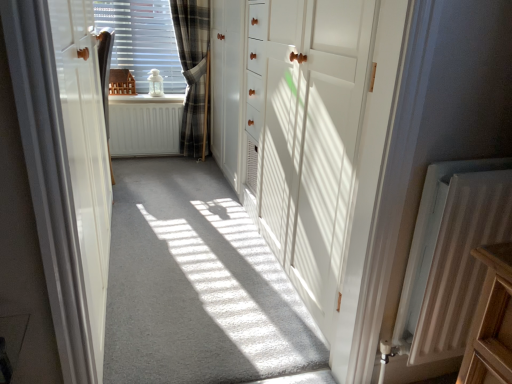
Describe the element at coordinates (311, 138) in the screenshot. The height and width of the screenshot is (384, 512). I see `white wood door at center, the first door viewed from the right` at that location.

The image size is (512, 384). Describe the element at coordinates (449, 258) in the screenshot. I see `white textured radiator at lower right, the first radiator viewed from the right` at that location.

Describe the element at coordinates (143, 40) in the screenshot. I see `translucent plastic window at center` at that location.

This screenshot has height=384, width=512. In order to click on plaid fabric curtain at center, which is the 1th curtain in back-to-front order in this screenshot , I will do `click(194, 73)`.

This screenshot has height=384, width=512. I want to click on white matte radiator at center, the 2th radiator when ordered from front to back, so click(x=144, y=126).

Identify the location of white glossy door at left, the 1th door from the left. (85, 153).

In order to face white glossy door at left, the 1th door from the left, should I rotate leftwards or rightwards?

You should look left and rotate roughly 23.320 degrees.

Identify the location of white wood door at center, the 2th door from the left. (311, 138).

Are white wood door at center, the 2th door from the left, and white glossy door at left, positioned as the second door in right-to-left order, located far from each other?

No, white wood door at center, the 2th door from the left, is not far from white glossy door at left, positioned as the second door in right-to-left order.

From the image's perspective, which is below, white wood door at center, the first door viewed from the right, or white glossy door at left, the 1th door from the left?

white glossy door at left, the 1th door from the left, from the image's perspective.

How much distance is there between white wood door at center, the 2th door from the left, and white glossy door at left, positioned as the second door in right-to-left order?

white wood door at center, the 2th door from the left, and white glossy door at left, positioned as the second door in right-to-left order, are 33.06 inches apart from each other.

Is white glossy door at left, the 1th door from the left, surrounded by white wood door at center, the first door viewed from the right?

No.

Considering the sizes of objects white matte radiator at center, the first radiator viewed from the top, and translucent plastic window at center in the image provided, who is thinner, white matte radiator at center, the first radiator viewed from the top, or translucent plastic window at center?

With smaller width is white matte radiator at center, the first radiator viewed from the top.

From a real-world perspective, which object rests below the other?

white matte radiator at center, the 1th radiator viewed from the left, from a real-world perspective.

Which of these two, white matte radiator at center, which is the first radiator in back-to-front order, or translucent plastic window at center, is smaller?

white matte radiator at center, which is the first radiator in back-to-front order, is smaller.

The image size is (512, 384). I want to click on the 1st radiator below when counting from the translucent plastic window at center (from the image's perspective), so click(x=144, y=126).

Is translucent plastic window at center oriented towards white carpet at center?

Yes.

From a real-world perspective, who is located higher, translucent plastic window at center or white carpet at center?

translucent plastic window at center.

From the picture: Is translucent plastic window at center located outside white carpet at center?

Absolutely, translucent plastic window at center is external to white carpet at center.

Based on the photo, which object is wider, translucent plastic window at center or white carpet at center?

Wider between the two is white carpet at center.

Is satin brown curtain at center, acting as the 1th curtain starting from the front, taller or shorter than plaid fabric curtain at center, which appears as the 2th curtain when viewed from the front?

satin brown curtain at center, acting as the 1th curtain starting from the front, is shorter than plaid fabric curtain at center, which appears as the 2th curtain when viewed from the front.

Based on their sizes in the image, would you say satin brown curtain at center, positioned as the 1th curtain in left-to-right order, is bigger or smaller than plaid fabric curtain at center, which is the 2th curtain from left to right?

satin brown curtain at center, positioned as the 1th curtain in left-to-right order, is smaller than plaid fabric curtain at center, which is the 2th curtain from left to right.

Is satin brown curtain at center, positioned as the 1th curtain in left-to-right order, positioned before plaid fabric curtain at center, which is the 1th curtain in back-to-front order?

Yes, satin brown curtain at center, positioned as the 1th curtain in left-to-right order, is in front of plaid fabric curtain at center, which is the 1th curtain in back-to-front order.

Which object is wider, satin brown curtain at center, acting as the 1th curtain starting from the front, or plaid fabric curtain at center, which is the 1th curtain in back-to-front order?

plaid fabric curtain at center, which is the 1th curtain in back-to-front order, is wider.

Based on the photo, in the image, is white matte radiator at center, the 2th radiator when ordered from front to back, on the left side or the right side of satin brown curtain at center, positioned as the 1th curtain in left-to-right order?

From the image, it's evident that white matte radiator at center, the 2th radiator when ordered from front to back, is to the right of satin brown curtain at center, positioned as the 1th curtain in left-to-right order.

From a real-world perspective, between white matte radiator at center, the 2th radiator in the right-to-left sequence, and satin brown curtain at center, acting as the 1th curtain starting from the front, who is vertically higher?

satin brown curtain at center, acting as the 1th curtain starting from the front, from a real-world perspective.

Does white matte radiator at center, the 1th radiator viewed from the left, have a larger size compared to satin brown curtain at center, the second curtain in the back-to-front sequence?

Incorrect, white matte radiator at center, the 1th radiator viewed from the left, is not larger than satin brown curtain at center, the second curtain in the back-to-front sequence.

Considering the relative sizes of white matte radiator at center, which ranks as the second radiator in bottom-to-top order, and satin brown curtain at center, acting as the 1th curtain starting from the front, in the image provided, is white matte radiator at center, which ranks as the second radiator in bottom-to-top order, thinner than satin brown curtain at center, acting as the 1th curtain starting from the front,?

Yes.

Considering the relative sizes of white carpet at center and white matte radiator at center, the 2th radiator when ordered from front to back, in the image provided, is white carpet at center thinner than white matte radiator at center, the 2th radiator when ordered from front to back,?

Incorrect, the width of white carpet at center is not less than that of white matte radiator at center, the 2th radiator when ordered from front to back.

Which is correct: white carpet at center is inside white matte radiator at center, which is the first radiator in back-to-front order, or outside of it?

white carpet at center is spatially situated outside white matte radiator at center, which is the first radiator in back-to-front order.

Which object is more forward, white carpet at center or white matte radiator at center, the 2th radiator when ordered from front to back?

Positioned in front is white carpet at center.

From a real-world perspective, who is located lower, white carpet at center or white matte radiator at center, which ranks as the second radiator in bottom-to-top order?

white carpet at center, from a real-world perspective.

Is point (192, 249) positioned behind point (100, 276)?

Yes, point (192, 249) is farther from viewer.

Between white carpet at center and white glossy door at left, the 1th door from the left, which one has larger size?

white glossy door at left, the 1th door from the left.

Is white carpet at center next to white glossy door at left, the 1th door from the left?

No, white carpet at center is not beside white glossy door at left, the 1th door from the left.

Does white carpet at center have a greater width compared to white glossy door at left, the 1th door from the left?

Correct, the width of white carpet at center exceeds that of white glossy door at left, the 1th door from the left.

Image resolution: width=512 pixels, height=384 pixels. What are the coordinates of `door in front of the white wood door at center, the 2th door from the left` in the screenshot? It's located at (85, 153).

Locate an element on the screen. This screenshot has height=384, width=512. window located above the white matte radiator at center, the 1th radiator viewed from the left (from the image's perspective) is located at coordinates (143, 40).

Based on their spatial positions, is plaid fabric curtain at center, which is the 2th curtain from left to right, or white glossy door at left, the 1th door from the left, closer to white carpet at center?

white glossy door at left, the 1th door from the left, is closer to white carpet at center.

Considering their positions, is white wood door at center, the 2th door from the left, positioned further to translucent plastic window at center than white matte radiator at center, the 2th radiator in the right-to-left sequence?

The object further to translucent plastic window at center is white wood door at center, the 2th door from the left.

Based on their spatial positions, is plaid fabric curtain at center, which is the 1th curtain in back-to-front order, or white carpet at center further from white matte radiator at center, the 2th radiator when ordered from front to back?

The object further to white matte radiator at center, the 2th radiator when ordered from front to back, is white carpet at center.

Estimate the real-world distances between objects in this image. Which object is further from satin brown curtain at center, acting as the 1th curtain starting from the front, white matte radiator at center, the 1th radiator viewed from the left, or white glossy door at left, positioned as the second door in right-to-left order?

Based on the image, white matte radiator at center, the 1th radiator viewed from the left, appears to be further to satin brown curtain at center, acting as the 1th curtain starting from the front.

From the image, which object appears to be farther from satin brown curtain at center, acting as the 1th curtain starting from the front, white wood door at center, the 2th door from the left, or plaid fabric curtain at center, which is the 2th curtain from left to right?

white wood door at center, the 2th door from the left, is further to satin brown curtain at center, acting as the 1th curtain starting from the front.

Considering their positions, is plaid fabric curtain at center, which is the 1th curtain in back-to-front order, positioned closer to satin brown curtain at center, acting as the 1th curtain starting from the front, than white carpet at center?

plaid fabric curtain at center, which is the 1th curtain in back-to-front order, is positioned closer to the anchor satin brown curtain at center, acting as the 1th curtain starting from the front.

In the scene shown: From the image, which object appears to be farther from white textured radiator at lower right, the 2th radiator viewed from the left, white matte radiator at center, which ranks as the second radiator in bottom-to-top order, or satin brown curtain at center, the second curtain when ordered from right to left?

The object further to white textured radiator at lower right, the 2th radiator viewed from the left, is white matte radiator at center, which ranks as the second radiator in bottom-to-top order.

Considering their positions, is white carpet at center positioned further to white matte radiator at center, the 2th radiator when ordered from front to back, than satin brown curtain at center, acting as the 1th curtain starting from the front?

white carpet at center is positioned further to the anchor white matte radiator at center, the 2th radiator when ordered from front to back.

I want to click on radiator located between white wood door at center, the first door viewed from the right, and white matte radiator at center, the 2th radiator in the right-to-left sequence, in the depth direction, so click(449, 258).

Image resolution: width=512 pixels, height=384 pixels. I want to click on window between white glossy door at left, the 1th door from the left, and white matte radiator at center, the 1th radiator viewed from the left, from front to back, so click(143, 40).

At what (x,y) coordinates should I click in order to perform the action: click on corridor positioned between white glossy door at left, positioned as the second door in right-to-left order, and satin brown curtain at center, the second curtain when ordered from right to left, from near to far. Please return your answer as a coordinate pair (x, y). Looking at the image, I should click on [x=199, y=287].

This screenshot has height=384, width=512. Identify the location of window positioned between white textured radiator at lower right, placed as the second radiator when sorted from top to bottom, and white matte radiator at center, which ranks as the second radiator in bottom-to-top order, from near to far. (143, 40).